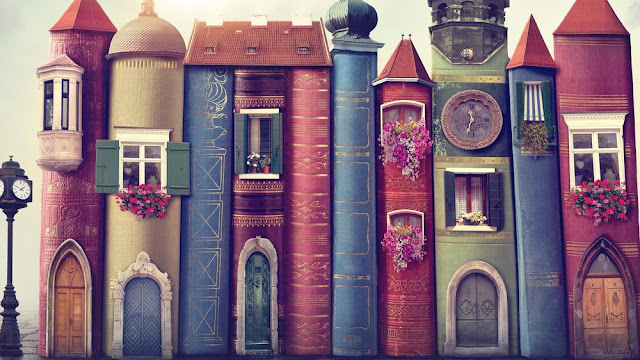
The width and height of the screenshot is (640, 360). I want to click on door ein, so click(180, 171).